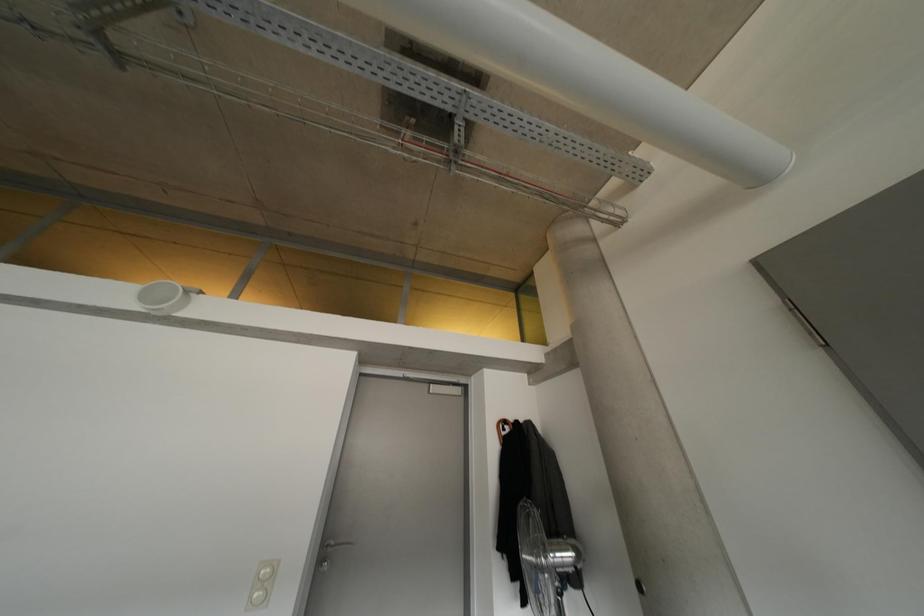
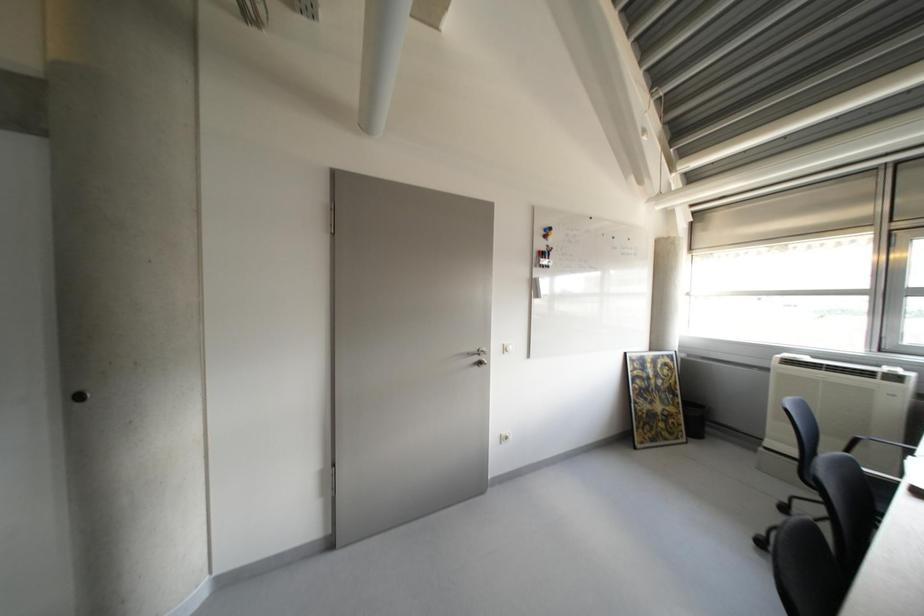
Question: The images are taken continuously from a first-person perspective. In which direction is your viewpoint rotating?

Choices:
 (A) Left
 (B) Right
 (C) Up
 (D) Down

Answer: (B)